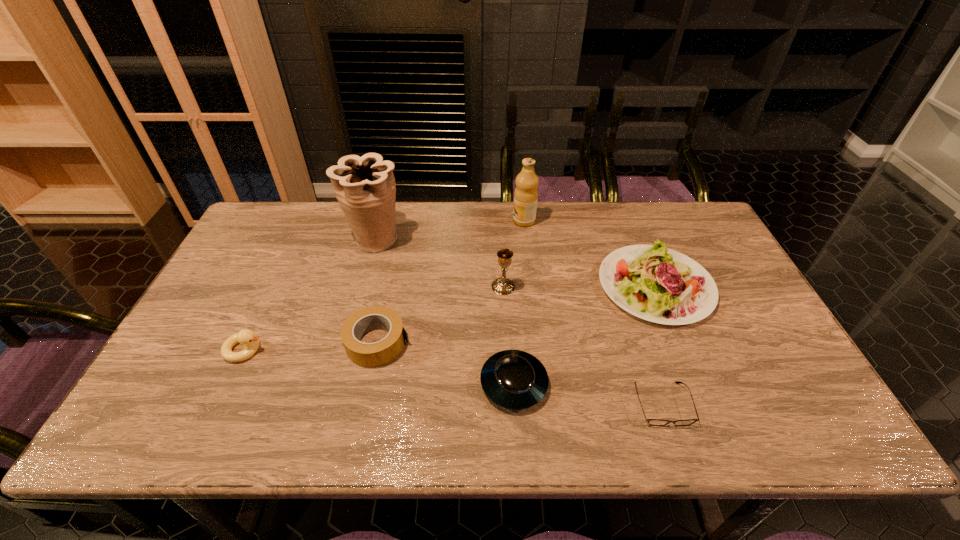
Find the location of a particular element. object that can be found as the fifth closest to the duct tape is located at coordinates (526, 193).

Locate an element on the screen. free location that satisfies the following two spatial constraints: 1. on the back side of the saucer; 2. at the beak of the leftmost object is located at coordinates (512, 349).

Find the location of `vacant area in the image that satisfies the following two spatial constraints: 1. on the front side of the urn; 2. on the left side of the chalice`. vacant area in the image that satisfies the following two spatial constraints: 1. on the front side of the urn; 2. on the left side of the chalice is located at coordinates (362, 287).

The image size is (960, 540). What are the coordinates of `vacant area in the image that satisfies the following two spatial constraints: 1. on the front side of the salad plate; 2. at the beak of the leftmost object` in the screenshot? It's located at (681, 349).

Identify the location of vacant space that satisfies the following two spatial constraints: 1. on the front side of the salad plate; 2. on the right side of the urn. (362, 286).

Find the location of `free spot that satisfies the following two spatial constraints: 1. on the front side of the urn; 2. at the beak of the leftmost object`. free spot that satisfies the following two spatial constraints: 1. on the front side of the urn; 2. at the beak of the leftmost object is located at coordinates (345, 349).

Find the location of a particular element. The height and width of the screenshot is (540, 960). free space that satisfies the following two spatial constraints: 1. on the front side of the salad plate; 2. on the right side of the urn is located at coordinates (362, 286).

Find the location of a particular element. Image resolution: width=960 pixels, height=540 pixels. free space that satisfies the following two spatial constraints: 1. on the front side of the urn; 2. on the left side of the chalice is located at coordinates (362, 287).